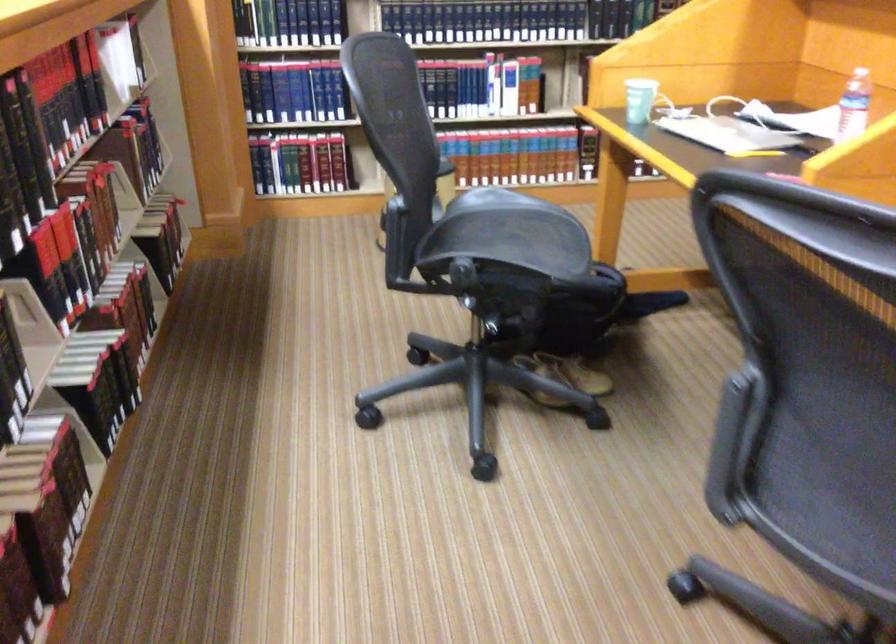
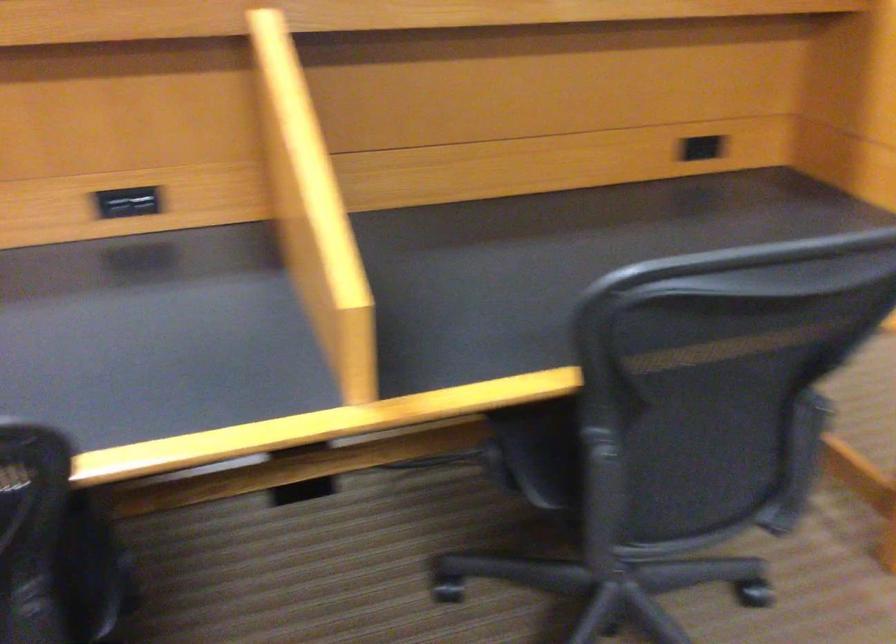
Question: I am providing you with two images of the same scene from different viewpoints. Please identify which objects are invisible in image2.

Choices:
 (A) white bottle lid
 (B) chair sitting surface
 (C) chair armrest
 (D) paper cup

Answer: (D)